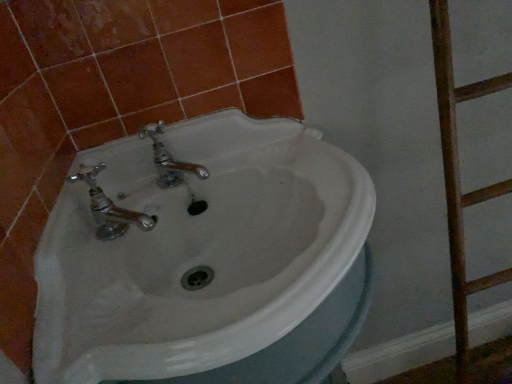
This screenshot has width=512, height=384. In order to click on white glossy sink at center in this screenshot , I will do `click(205, 258)`.

What do you see at coordinates (205, 258) in the screenshot? This screenshot has height=384, width=512. I see `white glossy sink at center` at bounding box center [205, 258].

The width and height of the screenshot is (512, 384). What do you see at coordinates (459, 177) in the screenshot? I see `rusty wood ladder at right` at bounding box center [459, 177].

Measure the distance between point (442, 133) and camera.

The distance of point (442, 133) from camera is 28.11 inches.

Locate an element on the screen. rusty wood ladder at right is located at coordinates (459, 177).

What are the coordinates of `white glossy sink at center` in the screenshot? It's located at (205, 258).

Considering the relative positions of white glossy sink at center and rusty wood ladder at right in the image provided, is white glossy sink at center to the right of rusty wood ladder at right from the viewer's perspective?

In fact, white glossy sink at center is to the left of rusty wood ladder at right.

Considering the positions of objects white glossy sink at center and rusty wood ladder at right in the image provided, who is behind, white glossy sink at center or rusty wood ladder at right?

rusty wood ladder at right is behind.

Does point (172, 335) come in front of point (466, 95)?

Yes, it is in front of point (466, 95).

From the image's perspective, between white glossy sink at center and rusty wood ladder at right, who is located below?

From the image's view, white glossy sink at center is below.

From a real-world perspective, relative to rusty wood ladder at right, is white glossy sink at center vertically above or below?

In terms of real-world spatial position, white glossy sink at center is below rusty wood ladder at right.

In the scene shown: Does white glossy sink at center have a greater width compared to rusty wood ladder at right?

Yes.

Between white glossy sink at center and rusty wood ladder at right, which one has more height?

rusty wood ladder at right.

Who is bigger, white glossy sink at center or rusty wood ladder at right?

white glossy sink at center.

Is white glossy sink at center situated inside rusty wood ladder at right or outside?

white glossy sink at center is spatially situated outside rusty wood ladder at right.

Is there a large distance between white glossy sink at center and rusty wood ladder at right?

No, white glossy sink at center is not far away from rusty wood ladder at right.

Is rusty wood ladder at right at the back of white glossy sink at center?

No, white glossy sink at center is not facing the opposite direction of rusty wood ladder at right.

How many degrees apart are the facing directions of white glossy sink at center and rusty wood ladder at right?

The angular difference between white glossy sink at center and rusty wood ladder at right is 0.00104 degrees.

You are a GUI agent. You are given a task and a screenshot of the screen. Output one action in this format:
    pyautogui.click(x=<x>, y=<y>)
    Task: Click on the ladder on the right of white glossy sink at center
    The height and width of the screenshot is (384, 512).
    Given the screenshot: What is the action you would take?
    pyautogui.click(x=459, y=177)

Between rusty wood ladder at right and white glossy sink at center, which one appears on the right side from the viewer's perspective?

rusty wood ladder at right.

Who is more distant, rusty wood ladder at right or white glossy sink at center?

rusty wood ladder at right is behind.

Which is behind, point (484, 286) or point (310, 154)?

The point (484, 286) is farther from the camera.

From the image's perspective, is rusty wood ladder at right located above or below white glossy sink at center?

From the image's perspective, rusty wood ladder at right appears above white glossy sink at center.

From a real-world perspective, between rusty wood ladder at right and white glossy sink at center, who is vertically lower?

In real-world perspective, white glossy sink at center is lower.

In terms of width, does rusty wood ladder at right look wider or thinner when compared to white glossy sink at center?

In the image, rusty wood ladder at right appears to be more narrow than white glossy sink at center.

From the picture: Does rusty wood ladder at right have a lesser height compared to white glossy sink at center?

No, rusty wood ladder at right is not shorter than white glossy sink at center.

Considering the relative sizes of rusty wood ladder at right and white glossy sink at center in the image provided, is rusty wood ladder at right smaller than white glossy sink at center?

Yes, rusty wood ladder at right is smaller than white glossy sink at center.

Is rusty wood ladder at right located outside white glossy sink at center?

Yes.

Is rusty wood ladder at right in contact with white glossy sink at center?

No.

Is rusty wood ladder at right oriented away from white glossy sink at center?

No, rusty wood ladder at right is not facing the opposite direction of white glossy sink at center.

Identify the location of ladder located behind the white glossy sink at center. (459, 177).

Find the location of a particular element. The image size is (512, 384). sink located on the left of rusty wood ladder at right is located at coordinates (205, 258).

Find the location of `sink lying below the rusty wood ladder at right (from the image's perspective)`. sink lying below the rusty wood ladder at right (from the image's perspective) is located at coordinates (205, 258).